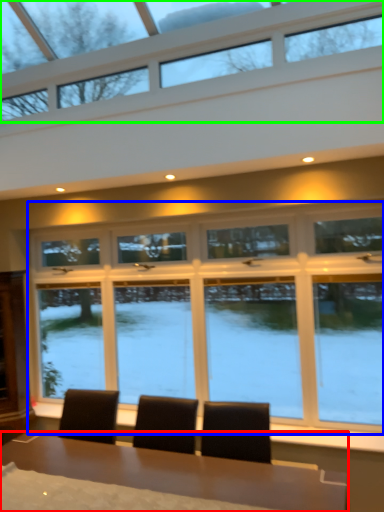
Question: Which object is the farthest from table (highlighted by a red box)? Choose among these: window (highlighted by a blue box) or window (highlighted by a green box).

Choices:
 (A) window
 (B) window

Answer: (B)